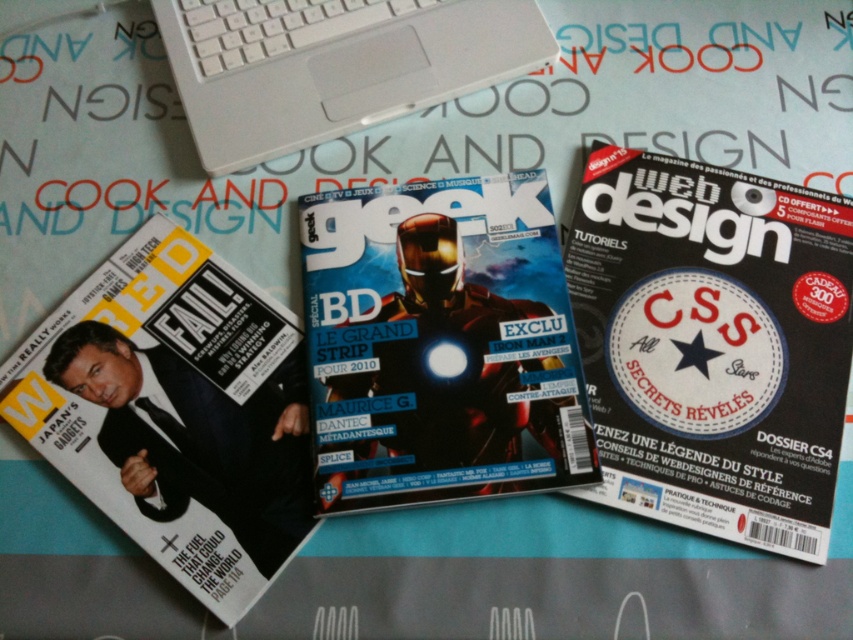
Can you confirm if metallic silver magazine at center is wider than white plastic laptop at upper center?

No.

The image size is (853, 640). What are the coordinates of `metallic silver magazine at center` in the screenshot? It's located at (440, 344).

Describe the element at coordinates (440, 344) in the screenshot. The image size is (853, 640). I see `metallic silver magazine at center` at that location.

This screenshot has width=853, height=640. I want to click on metallic silver magazine at center, so click(440, 344).

Is the position of matte black magazine at center more distant than that of matte black magazine at lower left?

Yes, matte black magazine at center is further from the viewer.

Consider the image. Can you confirm if matte black magazine at center is bigger than matte black magazine at lower left?

Correct, matte black magazine at center is larger in size than matte black magazine at lower left.

Measure the distance between matte black magazine at center and camera.

matte black magazine at center is 23.51 inches from camera.

Locate an element on the screen. matte black magazine at center is located at coordinates click(712, 344).

Who is taller, metallic silver magazine at center or matte black magazine at lower left?

matte black magazine at lower left

Does metallic silver magazine at center appear on the right side of matte black magazine at lower left?

Indeed, metallic silver magazine at center is positioned on the right side of matte black magazine at lower left.

Find the location of a particular element. Image resolution: width=853 pixels, height=640 pixels. metallic silver magazine at center is located at coordinates (440, 344).